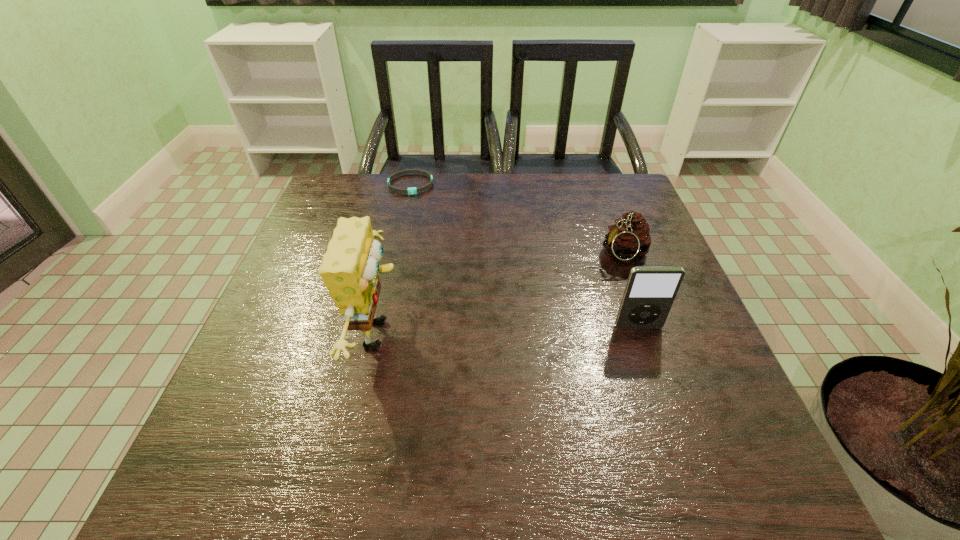
Identify the location of free spot on the desktop that is between the tallest object and the iPod and is positioned on the buckle of the farthest object. This screenshot has width=960, height=540. (475, 331).

This screenshot has height=540, width=960. I want to click on free spot on the desktop that is between the sponge and the iPod and is positioned with a leaf charm attached to the second farthest object, so click(493, 330).